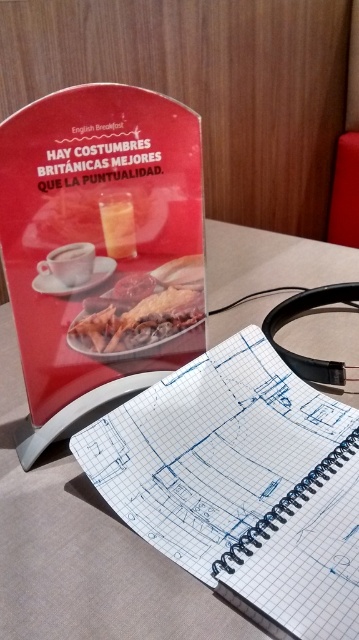
Question: Which point appears farthest from the camera in this image?

Choices:
 (A) (126, 298)
 (B) (264, 321)
 (C) (252, 390)

Answer: (B)

Question: Considering the real-world distances, which object is closest to the black rubber headphones at center?

Choices:
 (A) white grid paper at center
 (B) matte white cup at upper left

Answer: (A)

Question: Does white grid paper at center lie in front of golden crispy chicken at center?

Choices:
 (A) no
 (B) yes

Answer: (B)

Question: Which of these objects is positioned closest to the golden crispy chicken at center?

Choices:
 (A) matte white cup at upper left
 (B) black rubber headphones at center
 (C) white grid paper at center

Answer: (A)

Question: Is white grid paper at center positioned behind matte white cup at upper left?

Choices:
 (A) no
 (B) yes

Answer: (A)

Question: Can you confirm if white grid paper at center is positioned to the left of matte white cup at upper left?

Choices:
 (A) yes
 (B) no

Answer: (B)